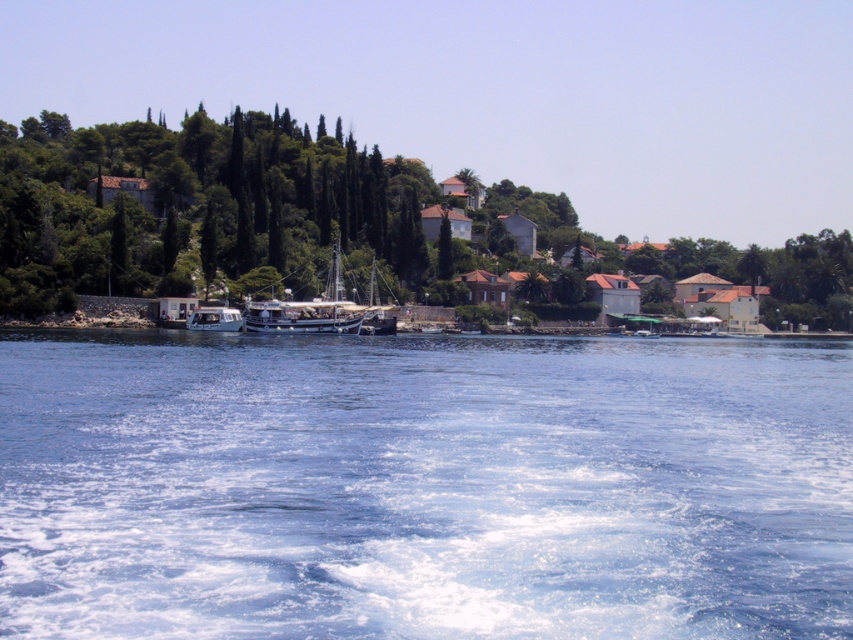
You are a photographer trying to capture the wooden sailboat at center without the green leafy tree at center blocking the view. Can you move to a position where the tree is not in front of the boat?

The green leafy tree at center is positioned over the wooden sailboat at center, so moving to a position where the tree is not in front of the boat would require moving to a lower elevation or angle where the tree is no longer above the boat.

You are standing on the shore looking out at the blue liquid water at lower center and the wooden sailboat at center. Which object is nearer to you?

The blue liquid water at lower center is closer to the viewer than the wooden sailboat at center.

You are standing on the shore looking at the blue liquid water at lower center and the white glossy boat at center. Which object is closer to you?

The blue liquid water at lower center is closer to you because it is located below the white glossy boat at center, placing it nearer in the visual hierarchy.